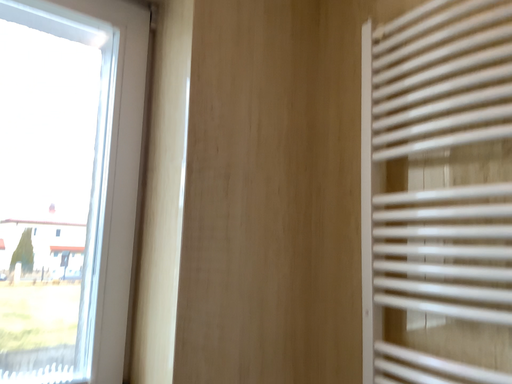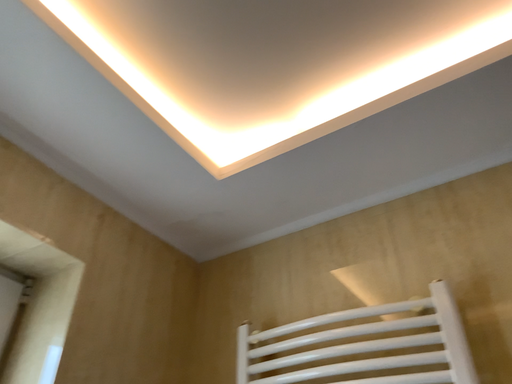
Question: How did the camera likely rotate when shooting the video?

Choices:
 (A) rotated upward
 (B) rotated downward

Answer: (A)